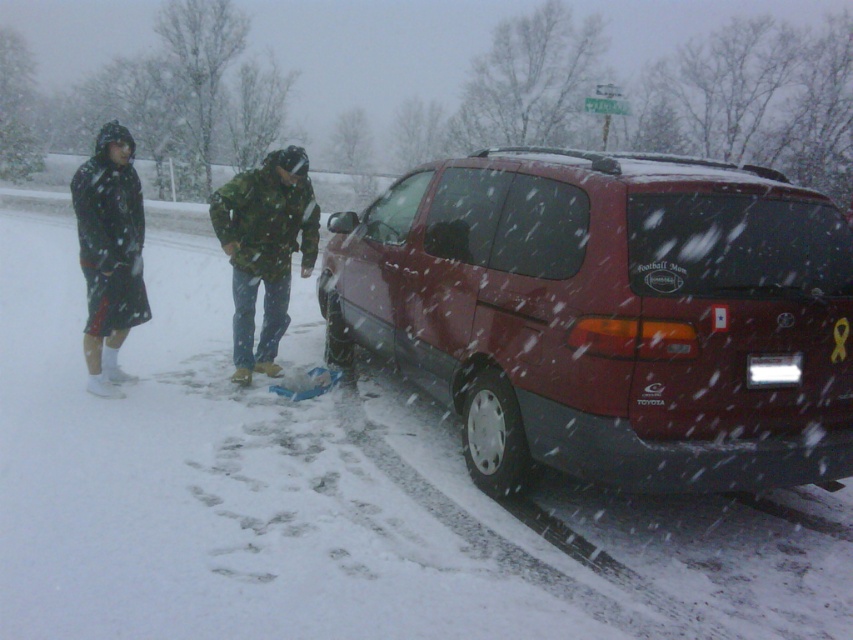
Is matte red minivan at center below matte black jacket at left?

Yes, matte red minivan at center is below matte black jacket at left.

Between point (695, 372) and point (120, 301), which one is positioned behind?

Point (120, 301)

Identify the location of matte red minivan at center. This screenshot has height=640, width=853. (608, 314).

Is camouflage fabric jacket at center taller than matte black jacket at left?

No, camouflage fabric jacket at center is not taller than matte black jacket at left.

Who is shorter, camouflage fabric jacket at center or matte black jacket at left?

Standing shorter between the two is camouflage fabric jacket at center.

The image size is (853, 640). What do you see at coordinates (264, 250) in the screenshot?
I see `camouflage fabric jacket at center` at bounding box center [264, 250].

Identify the location of camouflage fabric jacket at center. (264, 250).

Is matte red minivan at center further to the viewer compared to camouflage fabric jacket at center?

No, matte red minivan at center is in front of camouflage fabric jacket at center.

Which is in front, point (485, 273) or point (292, 161)?

Point (485, 273) is more forward.

This screenshot has width=853, height=640. Describe the element at coordinates (608, 314) in the screenshot. I see `matte red minivan at center` at that location.

Find the location of `matte red minivan at center`. matte red minivan at center is located at coordinates (608, 314).